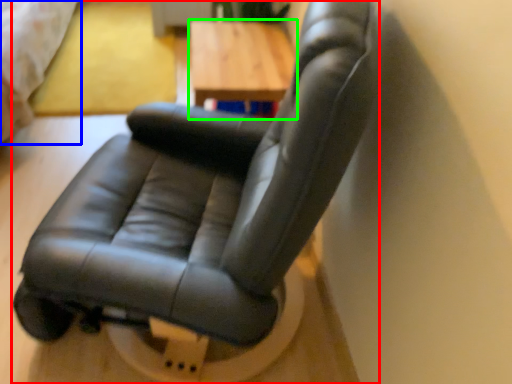
Question: Which object is positioned closest to chair (highlighted by a red box)? Select from bed (highlighted by a blue box) and table (highlighted by a green box).

Choices:
 (A) bed
 (B) table

Answer: (B)